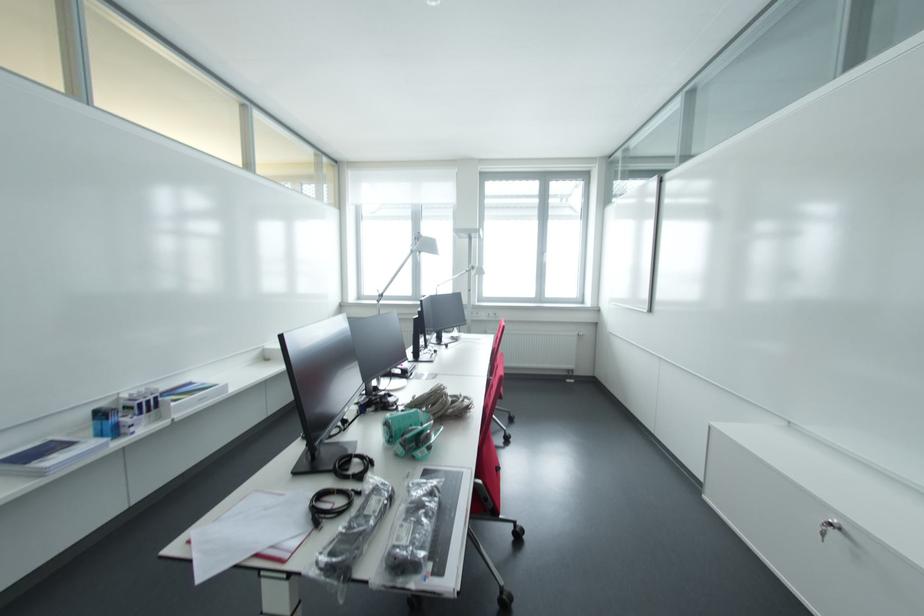
I want to click on cabinet key, so click(x=830, y=528).